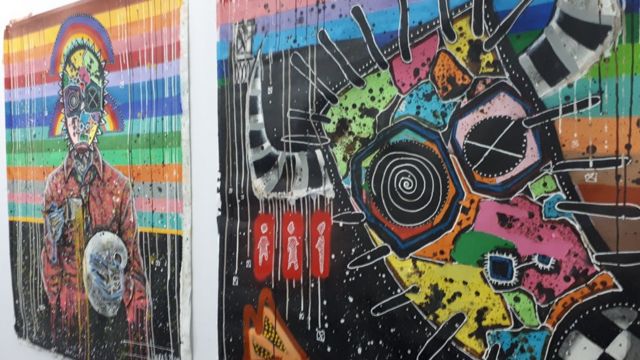
Locate an element on the screen. This screenshot has width=640, height=360. art on left is located at coordinates (42, 56), (140, 50), (157, 350), (36, 316).